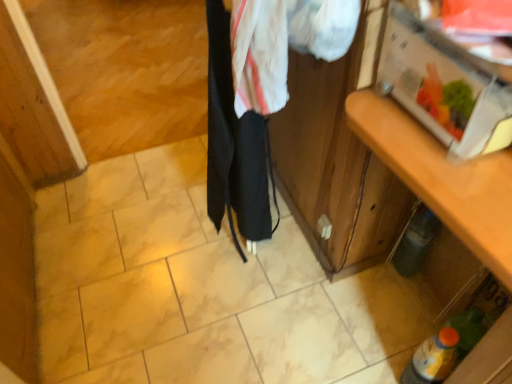
Describe the element at coordinates (415, 242) in the screenshot. I see `green matte bottle at lower right, which is the first bottle from top to bottom` at that location.

What are the coordinates of `yellow-orange plastic bottle at lower right, the second bottle positioned from the top` in the screenshot? It's located at (432, 359).

The width and height of the screenshot is (512, 384). What do you see at coordinates (438, 154) in the screenshot? I see `wooden cabinet at right` at bounding box center [438, 154].

The image size is (512, 384). Describe the element at coordinates (234, 144) in the screenshot. I see `black fabric at center` at that location.

The height and width of the screenshot is (384, 512). Find the location of `green matte bottle at lower right, which is counted as the second bottle, starting from the bottom`. green matte bottle at lower right, which is counted as the second bottle, starting from the bottom is located at coordinates (415, 242).

Which is more to the left, black fabric at center or green matte bottle at lower right, the 2th bottle when ordered from front to back?

black fabric at center is more to the left.

From the image's perspective, would you say black fabric at center is shown under green matte bottle at lower right, which is the first bottle from top to bottom?

No, from the image's perspective, black fabric at center is not beneath green matte bottle at lower right, which is the first bottle from top to bottom.

Is green matte bottle at lower right, which is the 1th bottle in back-to-front order, at the back of black fabric at center?

Yes, black fabric at center is facing away from green matte bottle at lower right, which is the 1th bottle in back-to-front order.

Relative to green matte bottle at lower right, which is the first bottle from top to bottom, is black fabric at center in front or behind?

black fabric at center is in front of green matte bottle at lower right, which is the first bottle from top to bottom.

You are a GUI agent. You are given a task and a screenshot of the screen. Output one action in this format:
    pyautogui.click(x=<x>, y=<y>)
    Task: Click on the cabinetry lying on the right of black fabric at center
    The width and height of the screenshot is (512, 384).
    Given the screenshot: What is the action you would take?
    pyautogui.click(x=438, y=154)

From a real-world perspective, is black fabric at center positioned under wooden cabinet at right based on gravity?

No, from a real-world perspective, black fabric at center is not beneath wooden cabinet at right.

Does black fabric at center have a smaller size compared to wooden cabinet at right?

Correct, black fabric at center occupies less space than wooden cabinet at right.

Between black fabric at center and wooden cabinet at right, which one has larger width?

wooden cabinet at right.

Considering the positions of objects yellow-orange plastic bottle at lower right, placed as the 2th bottle when sorted from back to front, and wooden cabinet at right in the image provided, who is more to the right, yellow-orange plastic bottle at lower right, placed as the 2th bottle when sorted from back to front, or wooden cabinet at right?

Positioned to the right is wooden cabinet at right.

Starting from the wooden cabinet at right, which bottle is the 1st one behind? Please provide its 2D coordinates.

[(432, 359)]

Is yellow-orange plastic bottle at lower right, which ranks as the 1th bottle in front-to-back order, in front of or behind wooden cabinet at right in the image?

yellow-orange plastic bottle at lower right, which ranks as the 1th bottle in front-to-back order, is behind wooden cabinet at right.

Are wooden cabinet at right and black fabric at center far apart?

That's not correct — wooden cabinet at right is a little close to black fabric at center.

Does wooden cabinet at right lie in front of black fabric at center?

Yes, it is in front of black fabric at center.

Considering the positions of points (489, 221) and (263, 127), is point (489, 221) closer to camera compared to point (263, 127)?

Yes.

Is black fabric at center at the left side of yellow-orange plastic bottle at lower right, the second bottle positioned from the top?

Correct, you'll find black fabric at center to the left of yellow-orange plastic bottle at lower right, the second bottle positioned from the top.

Is black fabric at center further to the viewer compared to yellow-orange plastic bottle at lower right, which ranks as the 1th bottle in front-to-back order?

That is False.

Does black fabric at center touch yellow-orange plastic bottle at lower right, which is the first bottle from bottom to top?

No, black fabric at center is not making contact with yellow-orange plastic bottle at lower right, which is the first bottle from bottom to top.

Is yellow-orange plastic bottle at lower right, the second bottle positioned from the top, thinner than green matte bottle at lower right, which is the 1th bottle in back-to-front order?

Yes.

Does yellow-orange plastic bottle at lower right, which ranks as the 1th bottle in front-to-back order, contain green matte bottle at lower right, which is counted as the second bottle, starting from the bottom?

That's incorrect, green matte bottle at lower right, which is counted as the second bottle, starting from the bottom, is not inside yellow-orange plastic bottle at lower right, which ranks as the 1th bottle in front-to-back order.

There is a green matte bottle at lower right, the 2th bottle when ordered from front to back. Identify the location of bottle above it (from a real-world perspective). The image size is (512, 384). (432, 359).

From the image's perspective, relative to yellow-orange plastic bottle at lower right, placed as the 2th bottle when sorted from back to front, is green matte bottle at lower right, which is counted as the second bottle, starting from the bottom, above or below?

Based on their image positions, green matte bottle at lower right, which is counted as the second bottle, starting from the bottom, is located above yellow-orange plastic bottle at lower right, placed as the 2th bottle when sorted from back to front.

Visually, is green matte bottle at lower right, which is counted as the second bottle, starting from the bottom, positioned to the left or to the right of yellow-orange plastic bottle at lower right, placed as the 2th bottle when sorted from back to front?

green matte bottle at lower right, which is counted as the second bottle, starting from the bottom, is positioned on yellow-orange plastic bottle at lower right, placed as the 2th bottle when sorted from back to front,'s right side.

The height and width of the screenshot is (384, 512). In order to click on bottle on the right of yellow-orange plastic bottle at lower right, placed as the 2th bottle when sorted from back to front in this screenshot , I will do `click(415, 242)`.

Where is `clothing that appears in front of the green matte bottle at lower right, which is the first bottle from top to bottom`? clothing that appears in front of the green matte bottle at lower right, which is the first bottle from top to bottom is located at coordinates (234, 144).

At what (x,y) coordinates should I click in order to perform the action: click on clothing above the wooden cabinet at right (from the image's perspective). Please return your answer as a coordinate pair (x, y). The width and height of the screenshot is (512, 384). Looking at the image, I should click on (234, 144).

Looking at the image, which one is located further to black fabric at center, green matte bottle at lower right, which is the first bottle from top to bottom, or wooden cabinet at right?

green matte bottle at lower right, which is the first bottle from top to bottom, is positioned further to the anchor black fabric at center.

Looking at the image, which one is located further to wooden cabinet at right, green matte bottle at lower right, the 2th bottle when ordered from front to back, or black fabric at center?

green matte bottle at lower right, the 2th bottle when ordered from front to back.

When comparing their distances from wooden cabinet at right, does black fabric at center or yellow-orange plastic bottle at lower right, which ranks as the 1th bottle in front-to-back order, seem further?

Among the two, black fabric at center is located further to wooden cabinet at right.

Estimate the real-world distances between objects in this image. Which object is further from black fabric at center, green matte bottle at lower right, the 2th bottle when ordered from front to back, or yellow-orange plastic bottle at lower right, the second bottle positioned from the top?

yellow-orange plastic bottle at lower right, the second bottle positioned from the top, is positioned further to the anchor black fabric at center.

Based on their spatial positions, is yellow-orange plastic bottle at lower right, the second bottle positioned from the top, or green matte bottle at lower right, which is counted as the second bottle, starting from the bottom, closer to wooden cabinet at right?

Based on the image, yellow-orange plastic bottle at lower right, the second bottle positioned from the top, appears to be nearer to wooden cabinet at right.

Estimate the real-world distances between objects in this image. Which object is closer to black fabric at center, wooden cabinet at right or yellow-orange plastic bottle at lower right, which ranks as the 1th bottle in front-to-back order?

wooden cabinet at right is closer to black fabric at center.

Looking at the image, which one is located further to wooden cabinet at right, yellow-orange plastic bottle at lower right, which is the first bottle from bottom to top, or black fabric at center?

Among the two, black fabric at center is located further to wooden cabinet at right.

Considering their positions, is black fabric at center positioned closer to green matte bottle at lower right, which is the first bottle from top to bottom, than wooden cabinet at right?

black fabric at center is positioned closer to the anchor green matte bottle at lower right, which is the first bottle from top to bottom.

I want to click on clothing located between wooden cabinet at right and green matte bottle at lower right, which is the 1th bottle in back-to-front order, in the depth direction, so (x=234, y=144).

Where is `cabinetry between black fabric at center and yellow-orange plastic bottle at lower right, which ranks as the 1th bottle in front-to-back order, vertically`? cabinetry between black fabric at center and yellow-orange plastic bottle at lower right, which ranks as the 1th bottle in front-to-back order, vertically is located at coordinates (438, 154).

Where is `bottle between wooden cabinet at right and green matte bottle at lower right, which is the 1th bottle in back-to-front order, in the front-back direction`? bottle between wooden cabinet at right and green matte bottle at lower right, which is the 1th bottle in back-to-front order, in the front-back direction is located at coordinates (432, 359).

Find the location of a particular element. Image resolution: width=512 pixels, height=384 pixels. bottle that lies between black fabric at center and yellow-orange plastic bottle at lower right, the second bottle positioned from the top, from top to bottom is located at coordinates coord(415,242).